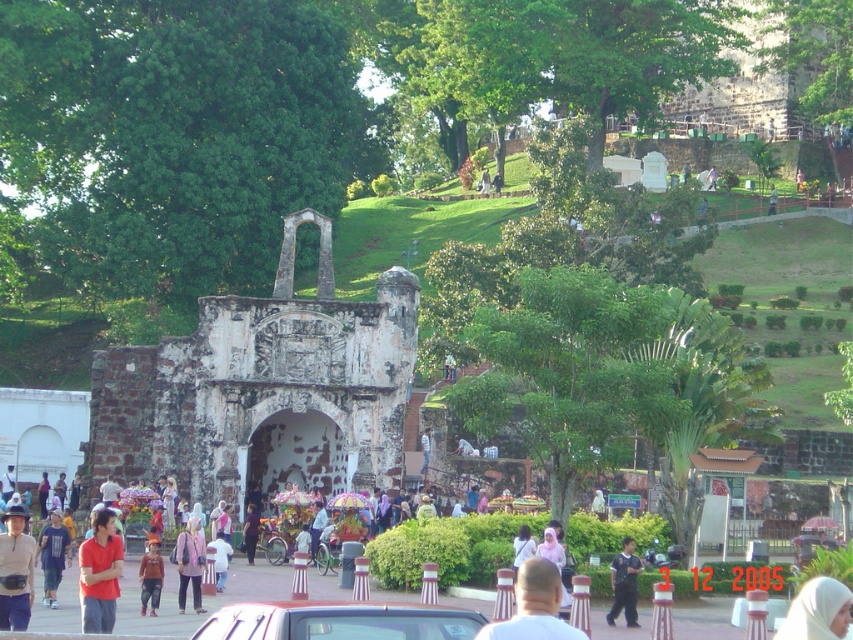
Question: Which of the following is the farthest from the observer?

Choices:
 (A) (611, 604)
 (B) (56, 605)
 (C) (531, 595)

Answer: (A)

Question: Which point is farther to the camera?

Choices:
 (A) matte purple shirt at center
 (B) smooth bald head at center
 (C) matte brown shirt at center
 (D) dark blue shirt at center

Answer: (D)

Question: Can you confirm if white fabric headscarf at center is positioned below light brown fabric headscarf at center?

Choices:
 (A) yes
 (B) no

Answer: (A)

Question: Which object is closer to the camera taking this photo?

Choices:
 (A) matte brown shirt at center
 (B) orange cotton shirt at center

Answer: (A)

Question: Does white fabric headscarf at center appear on the left side of white matte shirt at center?

Choices:
 (A) no
 (B) yes

Answer: (A)

Question: Does matte brown shirt at center appear under white fabric headscarf at center?

Choices:
 (A) yes
 (B) no

Answer: (B)